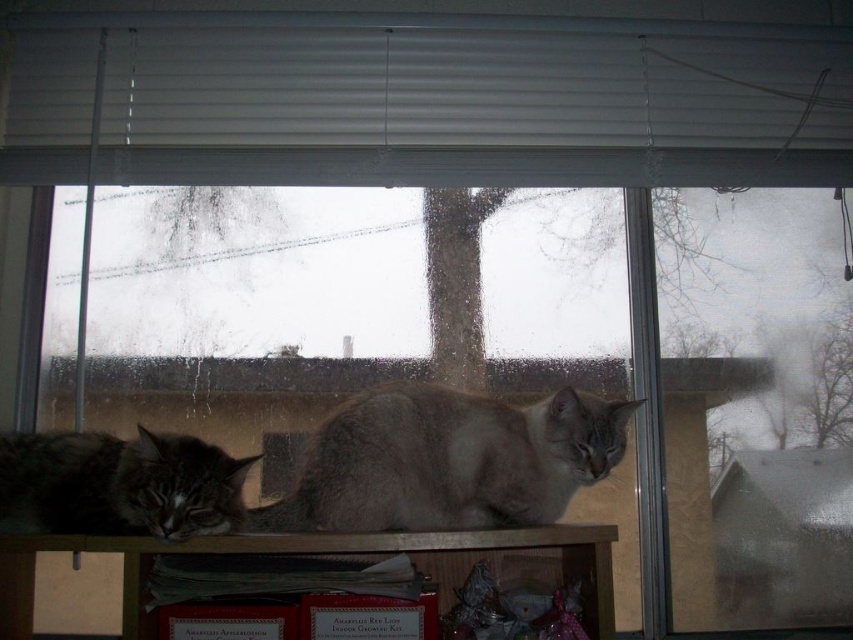
Question: Can you confirm if gray fur cat at center is positioned below gray fluffy cat at lower left?

Choices:
 (A) no
 (B) yes

Answer: (A)

Question: Does gray fur cat at center lie in front of gray fluffy cat at lower left?

Choices:
 (A) no
 (B) yes

Answer: (A)

Question: Which point is closer to the camera taking this photo?

Choices:
 (A) (28, 572)
 (B) (10, 484)
 (C) (540, 419)

Answer: (B)

Question: Among these objects, which one is farthest from the camera?

Choices:
 (A) wooden shelf at lower center
 (B) white matte blinds at upper center
 (C) gray fur cat at center
 (D) gray fluffy cat at lower left

Answer: (B)

Question: Can you confirm if white matte blinds at upper center is positioned to the right of gray fluffy cat at lower left?

Choices:
 (A) yes
 (B) no

Answer: (A)

Question: Among these objects, which one is farthest from the camera?

Choices:
 (A) white matte blinds at upper center
 (B) gray fur cat at center
 (C) wooden shelf at lower center
 (D) gray fluffy cat at lower left

Answer: (A)